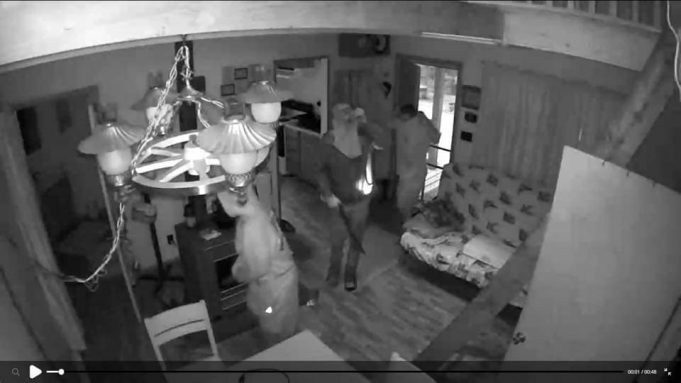
Image resolution: width=681 pixels, height=383 pixels. I want to click on floor, so click(x=383, y=308).